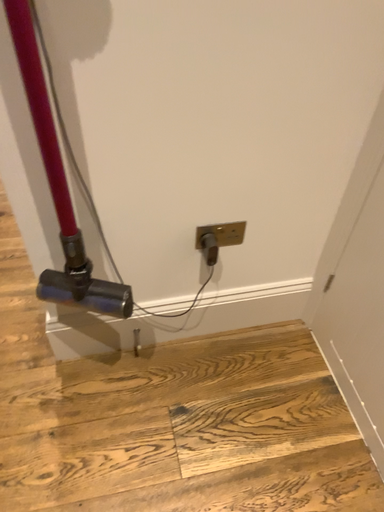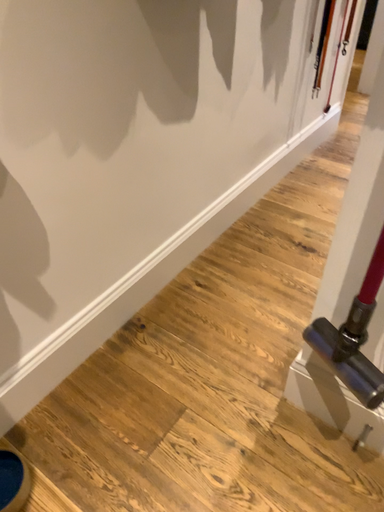
Question: How did the camera likely rotate when shooting the video?

Choices:
 (A) rotated downward
 (B) rotated upward

Answer: (B)